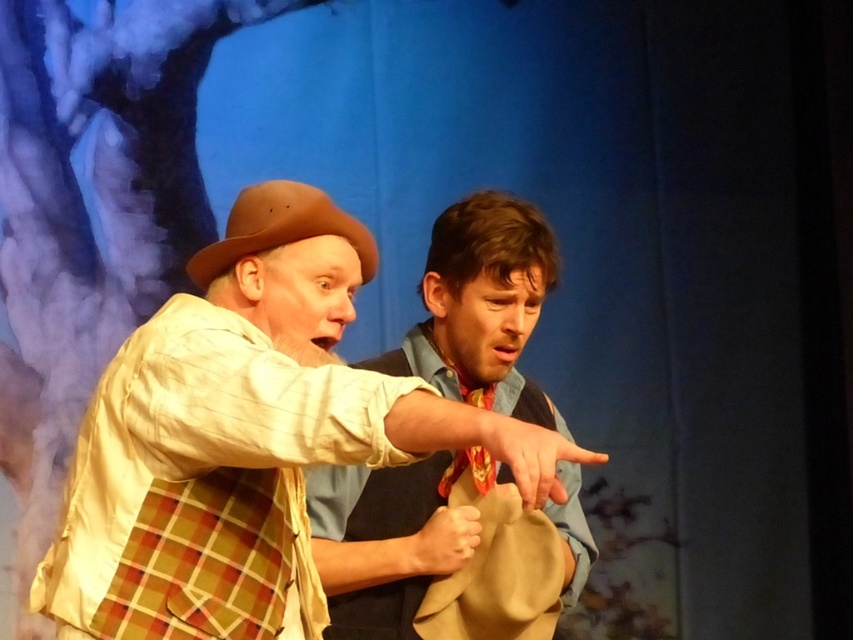
Question: Which point is closer to the camera?

Choices:
 (A) (276, 212)
 (B) (207, 582)

Answer: (B)

Question: Can you confirm if matte brown hat at center is positioned to the left of brown felt cowboy hat at left?

Choices:
 (A) no
 (B) yes

Answer: (A)

Question: Which object is closer to the camera taking this photo?

Choices:
 (A) matte brown hat at center
 (B) brown felt cowboy hat at left

Answer: (A)

Question: Observing the image, what is the correct spatial positioning of matte brown hat at center in reference to brown felt cowboy hat at left?

Choices:
 (A) right
 (B) left

Answer: (A)

Question: Can you confirm if matte brown hat at center is positioned to the right of brown felt cowboy hat at left?

Choices:
 (A) yes
 (B) no

Answer: (A)

Question: Which of the following is the farthest from the observer?

Choices:
 (A) (79, 540)
 (B) (206, 285)

Answer: (B)